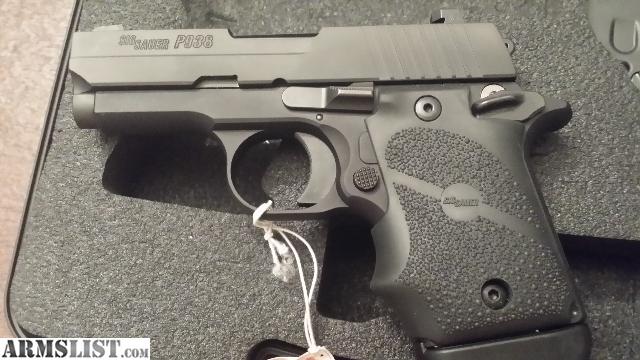
Where is `plate`? The height and width of the screenshot is (360, 640). plate is located at coordinates pyautogui.click(x=162, y=243).